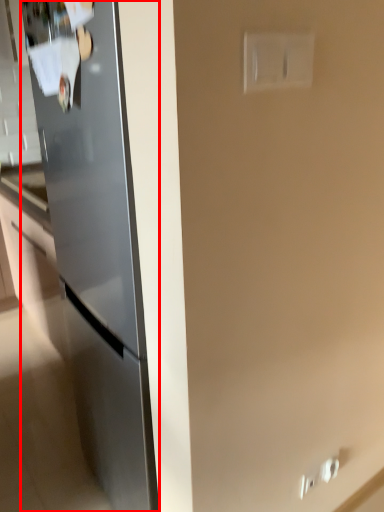
Question: In this image, where is refrigerator (annotated by the red box) located relative to electric outlet?

Choices:
 (A) left
 (B) right

Answer: (A)